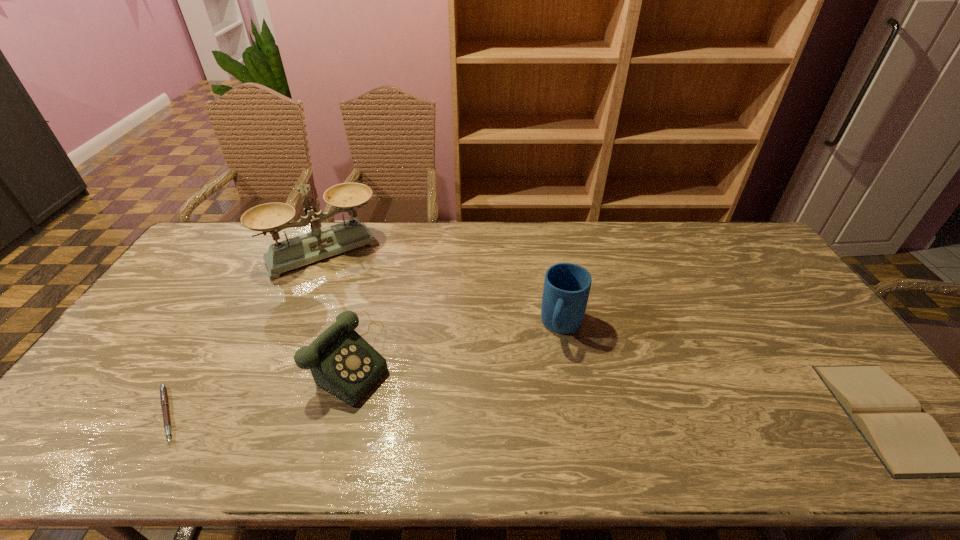
You are a GUI agent. You are given a task and a screenshot of the screen. Output one action in this format:
    pyautogui.click(x=<x>, y=<y>)
    Task: Click on the vacant space on the desktop that is between the shortest object and the second shortest object and is positioned on the side of the fourth object from left to right with the handle
    Image resolution: width=960 pixels, height=540 pixels.
    Given the screenshot: What is the action you would take?
    pyautogui.click(x=532, y=415)

At what (x,y) coordinates should I click in order to perform the action: click on free space on the desktop that is between the pen and the rightmost object and is positioned on the dial of the telephone. Please return your answer as a coordinate pair (x, y). The height and width of the screenshot is (540, 960). Looking at the image, I should click on (456, 415).

Locate an element on the screen. The height and width of the screenshot is (540, 960). vacant space on the desktop that is between the pen and the fourth tallest object and is positioned on the front-facing side of the tallest object is located at coordinates (419, 415).